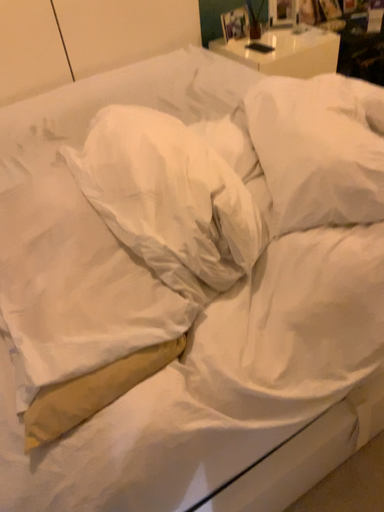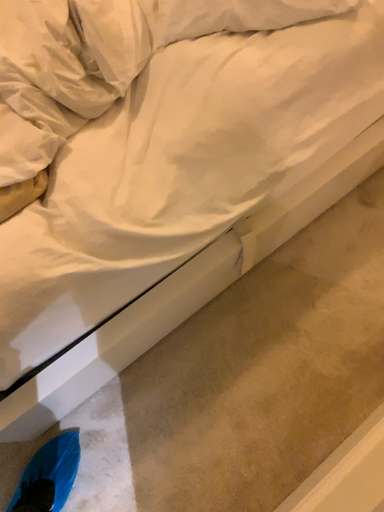
Question: How did the camera likely rotate when shooting the video?

Choices:
 (A) rotated right
 (B) rotated left

Answer: (A)